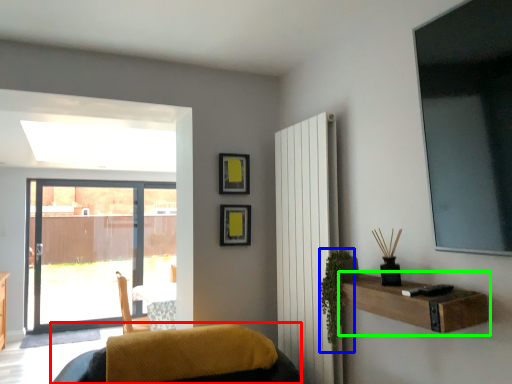
Question: Based on their relative distances, which object is nearer to furniture (highlighted by a red box)? Choose from plant (highlighted by a blue box) and shelf (highlighted by a green box).

Choices:
 (A) plant
 (B) shelf

Answer: (A)